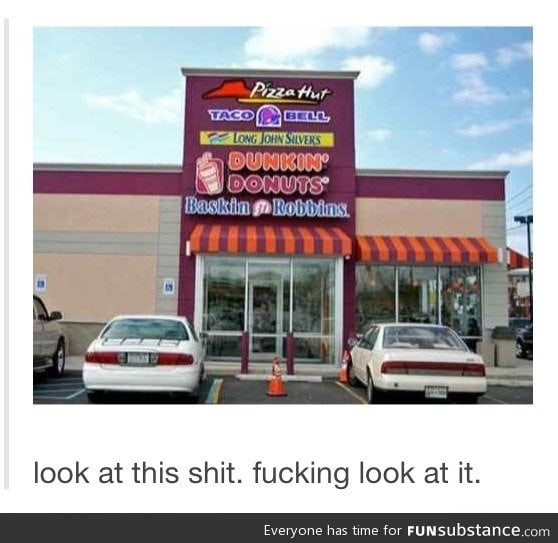
What are the coordinates of `doors` in the screenshot? It's located at (264, 308).